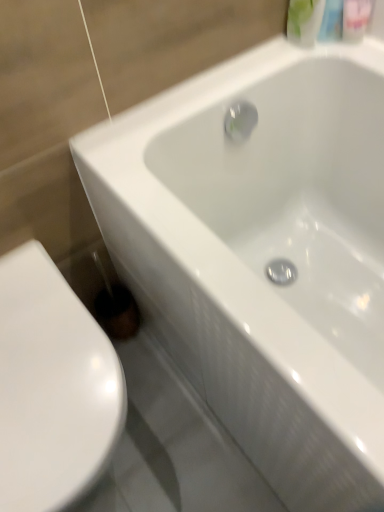
Question: Is white glossy toilet at lower left thinner than translucent plastic mouthwash at upper right, which is the first mouthwash from right to left?

Choices:
 (A) no
 (B) yes

Answer: (A)

Question: From a real-world perspective, is white glossy toilet at lower left below translucent plastic mouthwash at upper right, which is the first mouthwash from right to left?

Choices:
 (A) yes
 (B) no

Answer: (A)

Question: Is white glossy toilet at lower left further to camera compared to translucent plastic mouthwash at upper right, which is the first mouthwash from right to left?

Choices:
 (A) no
 (B) yes

Answer: (A)

Question: Is white glossy toilet at lower left looking in the opposite direction of translucent plastic mouthwash at upper right, which is the first mouthwash from right to left?

Choices:
 (A) no
 (B) yes

Answer: (A)

Question: From the image's perspective, is white glossy toilet at lower left beneath translucent plastic mouthwash at upper right, which is the first mouthwash from right to left?

Choices:
 (A) no
 (B) yes

Answer: (B)

Question: Would you say white glossy toilet at lower left is inside or outside translucent plastic mouthwash at upper right, which is the first mouthwash from right to left?

Choices:
 (A) outside
 (B) inside

Answer: (A)

Question: Is point (33, 304) closer or farther from the camera than point (365, 11)?

Choices:
 (A) farther
 (B) closer

Answer: (B)

Question: Based on their sizes in the image, would you say white glossy toilet at lower left is bigger or smaller than translucent plastic mouthwash at upper right, which is the first mouthwash from right to left?

Choices:
 (A) big
 (B) small

Answer: (A)

Question: In terms of width, does white glossy toilet at lower left look wider or thinner when compared to translucent plastic mouthwash at upper right, which is the first mouthwash from right to left?

Choices:
 (A) wide
 (B) thin

Answer: (A)

Question: Is point (365, 28) closer or farther from the camera than point (294, 12)?

Choices:
 (A) closer
 (B) farther

Answer: (B)

Question: Would you say translucent plastic mouthwash at upper right, marked as the 2th mouthwash in a left-to-right arrangement, is inside or outside green matte bottle at upper right, the second mouthwash when ordered from right to left?

Choices:
 (A) inside
 (B) outside

Answer: (B)

Question: From a real-world perspective, is translucent plastic mouthwash at upper right, which is the first mouthwash from right to left, above or below green matte bottle at upper right, the second mouthwash when ordered from right to left?

Choices:
 (A) above
 (B) below

Answer: (B)

Question: Considering the positions of translucent plastic mouthwash at upper right, which is the first mouthwash from right to left, and green matte bottle at upper right, the second mouthwash when ordered from right to left, in the image, is translucent plastic mouthwash at upper right, which is the first mouthwash from right to left, taller or shorter than green matte bottle at upper right, the second mouthwash when ordered from right to left,?

Choices:
 (A) short
 (B) tall

Answer: (A)

Question: Considering the positions of white glossy toilet at lower left and green matte bottle at upper right, the second mouthwash when ordered from right to left, in the image, is white glossy toilet at lower left wider or thinner than green matte bottle at upper right, the second mouthwash when ordered from right to left,?

Choices:
 (A) thin
 (B) wide

Answer: (B)

Question: Considering the positions of white glossy toilet at lower left and green matte bottle at upper right, the first mouthwash when ordered from left to right, in the image, is white glossy toilet at lower left bigger or smaller than green matte bottle at upper right, the first mouthwash when ordered from left to right,?

Choices:
 (A) big
 (B) small

Answer: (A)